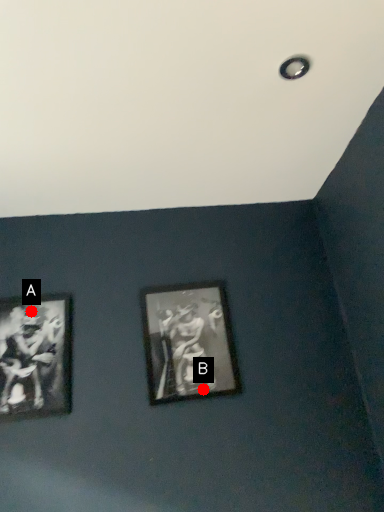
Question: Two points are circled on the image, labeled by A and B beside each circle. Which point is farther to the camera?

Choices:
 (A) A is further
 (B) B is further

Answer: (A)